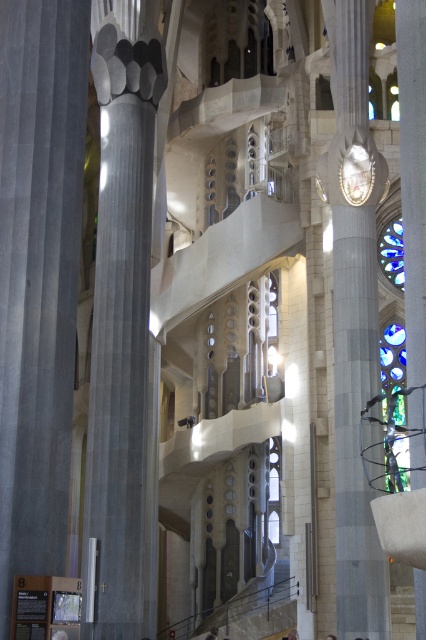
Question: Which point is farther to the camera?

Choices:
 (A) (123, 339)
 (B) (351, 134)

Answer: (B)

Question: Where is gray stone column at left located in relation to blue stained glass at right in the image?

Choices:
 (A) below
 (B) above

Answer: (A)

Question: From the image, what is the correct spatial relationship of slate gray stone column at left in relation to gray stone pillar at right?

Choices:
 (A) below
 (B) above

Answer: (A)

Question: Considering the real-world distances, which object is farthest from the gray stone pillar at right?

Choices:
 (A) gray stone column at left
 (B) slate gray stone column at left
 (C) blue stained glass at right

Answer: (A)

Question: Considering the real-world distances, which object is closest to the gray stone column at left?

Choices:
 (A) gray stone pillar at right
 (B) blue stained glass at right

Answer: (A)

Question: Is gray stone column at left thinner than gray stone pillar at right?

Choices:
 (A) no
 (B) yes

Answer: (B)